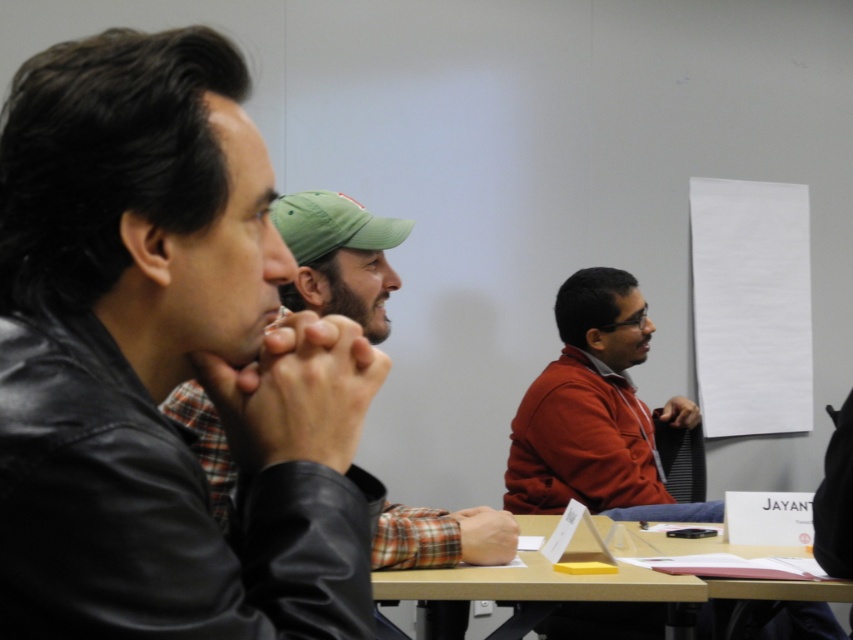
Question: Which object is closer to the camera taking this photo?

Choices:
 (A) leather jacket at left
 (B) matte red jacket at center
 (C) leather jacket at center

Answer: (A)

Question: Which of the following is the farthest from the observer?

Choices:
 (A) (601, 474)
 (B) (392, 502)
 (C) (132, 550)

Answer: (A)

Question: Observing the image, what is the correct spatial positioning of matte red jacket at center in reference to wooden table at center?

Choices:
 (A) left
 (B) right

Answer: (B)

Question: Is leather jacket at left closer to the viewer compared to matte red jacket at center?

Choices:
 (A) no
 (B) yes

Answer: (B)

Question: Which is nearer to the leather jacket at left?

Choices:
 (A) matte red jacket at center
 (B) leather jacket at center

Answer: (B)

Question: Can you confirm if leather jacket at left is smaller than leather jacket at center?

Choices:
 (A) yes
 (B) no

Answer: (A)